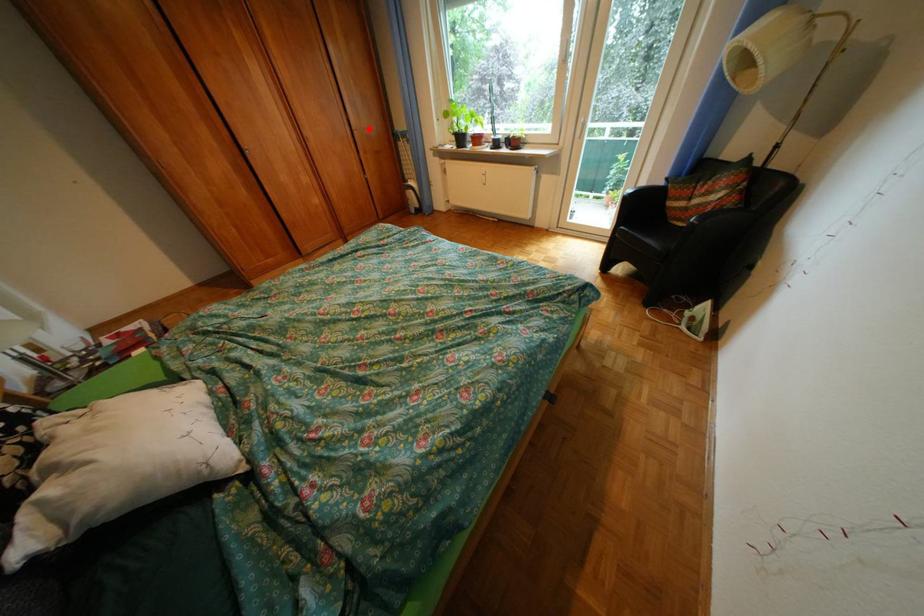
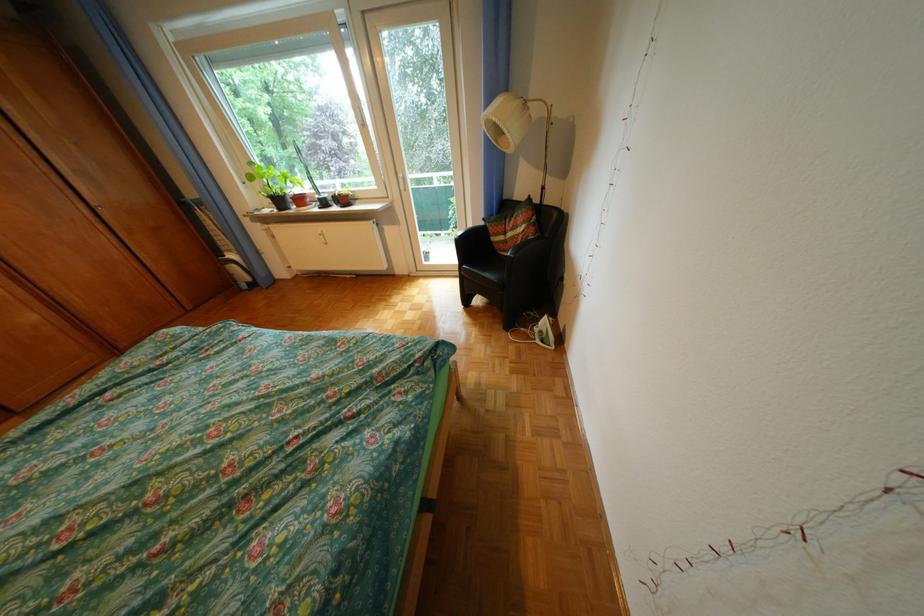
Locate, in the second image, the point that corresponds to the highlighted location in the first image.

(110, 205)